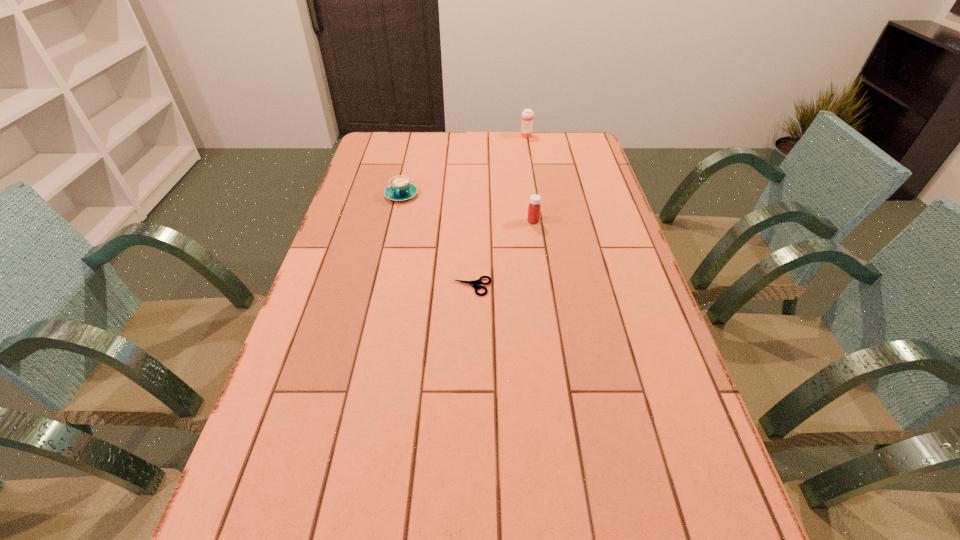
You are a GUI agent. You are given a task and a screenshot of the screen. Output one action in this format:
    pyautogui.click(x=<x>, y=<y>)
    Task: Click on the vacant space situated with the handle on the right side of the third tallest object
    
    Given the screenshot: What is the action you would take?
    pyautogui.click(x=388, y=254)

The width and height of the screenshot is (960, 540). In order to click on vacant point located on the front of the shears in this screenshot , I will do `click(470, 346)`.

Image resolution: width=960 pixels, height=540 pixels. What are the coordinates of `object situated at the far edge` in the screenshot? It's located at (527, 115).

Identify the location of object at the left edge. (400, 189).

The image size is (960, 540). I want to click on vacant region at the far edge of the desktop, so click(446, 154).

The height and width of the screenshot is (540, 960). In the image, there is a desktop. In order to click on vacant space at the left edge in this screenshot , I will do `click(350, 194)`.

At what (x,y) coordinates should I click in order to perform the action: click on free space at the right edge of the desktop. Please return your answer as a coordinate pair (x, y). This screenshot has height=540, width=960. Looking at the image, I should click on (603, 192).

Where is `free space at the far right corner of the desktop`? The image size is (960, 540). free space at the far right corner of the desktop is located at coordinates (558, 152).

This screenshot has height=540, width=960. Find the location of `vacant space that's between the shorter medicine and the tallest object`. vacant space that's between the shorter medicine and the tallest object is located at coordinates (530, 179).

Locate an element on the screen. This screenshot has height=540, width=960. free space between the second shortest object and the second nearest object is located at coordinates 468,208.